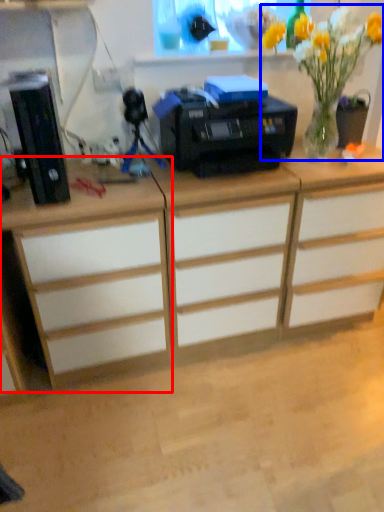
Question: Which point is further to the camera, desk (highlighted by a red box) or floral arrangement (highlighted by a blue box)?

Choices:
 (A) desk
 (B) floral arrangement

Answer: (B)